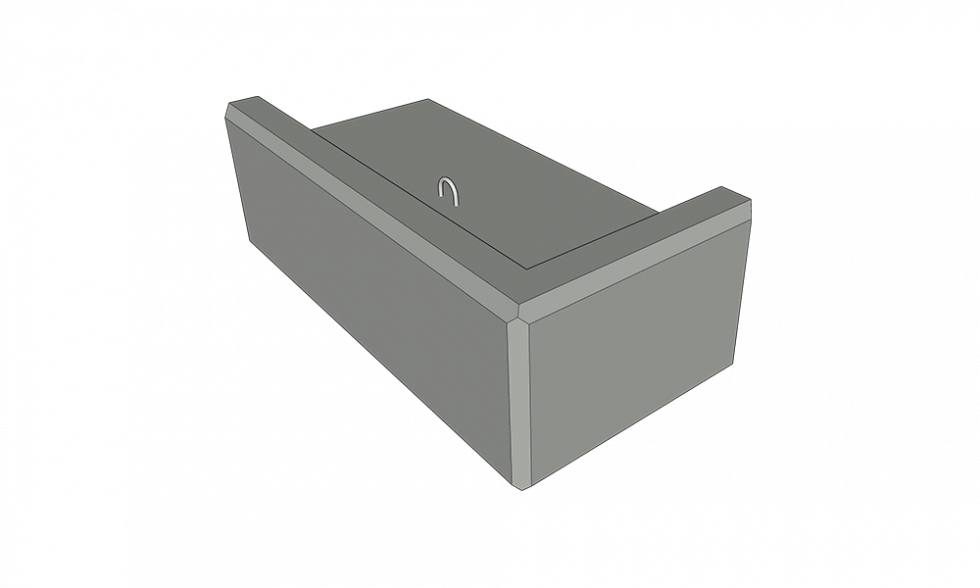
Image resolution: width=980 pixels, height=588 pixels. Find the location of `corner`. corner is located at coordinates (515, 312).